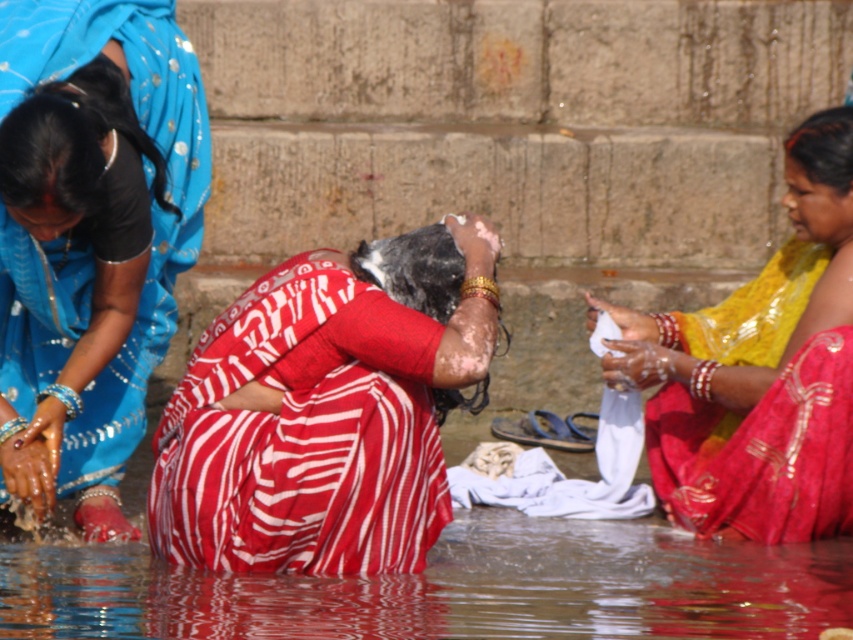
You are a photographer trying to capture the exact position of the matte red sari at center for a cultural documentary. According to the coordinates provided, where should you focus your camera lens to ensure the sari is centered in the frame?

The matte red sari at center is located at coordinates point [90,237], so you should focus your camera lens at that point to center it in the frame.

You are a photographer trying to capture the scene of the matte red sari at center and the clear water at lower center. Which object is closer to your camera lens?

The matte red sari at center is closer to the camera lens because it is positioned further to the viewer than the clear water at lower center.